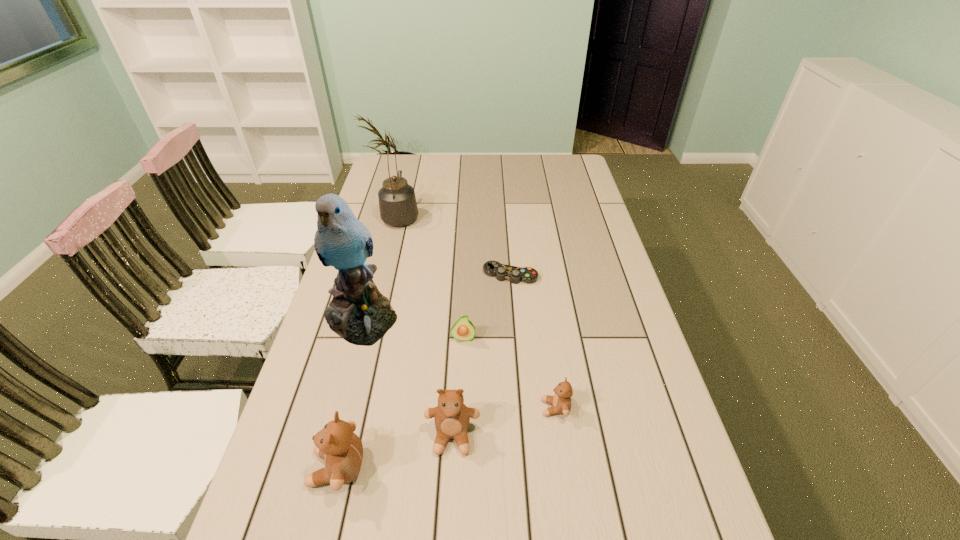
Observe the arrangement of all teddy bears in the image. To keep them evenly spaced, where would you place another teddy bear on the right? Please locate a free space. Please provide its 2D coordinates. Your answer should be formatted as a tuple, i.e. [(x, y)], where the tuple contains the x and y coordinates of a point satisfying the conditions above.

[(649, 382)]